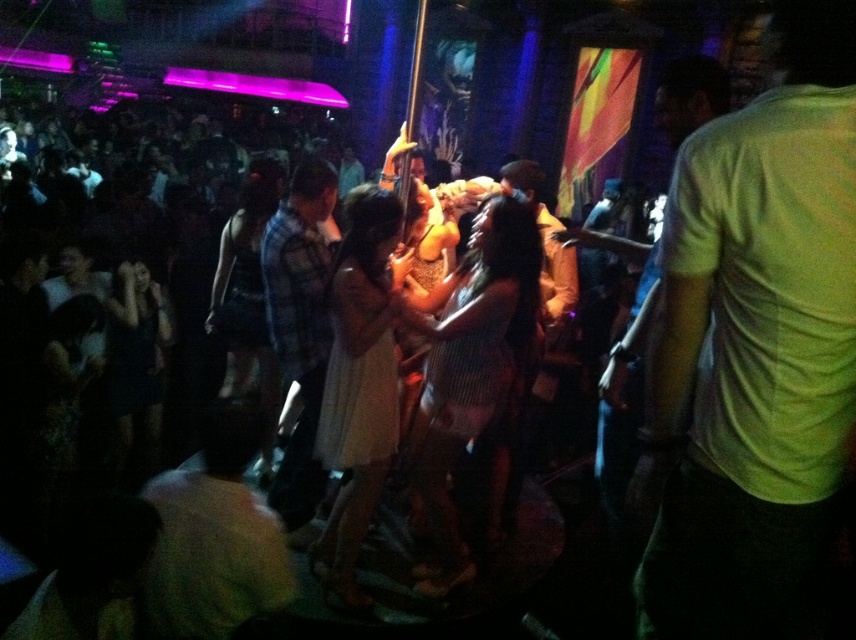
Question: Where is white matte shirt at lower left located in relation to plaid fabric shirt at center in the image?

Choices:
 (A) below
 (B) above

Answer: (A)

Question: Is light green t-shirt at right above plaid fabric shirt at center?

Choices:
 (A) yes
 (B) no

Answer: (A)

Question: Which object is closer to the camera taking this photo?

Choices:
 (A) white matte shirt at lower left
 (B) light green t-shirt at right
 (C) plaid fabric shirt at center

Answer: (B)

Question: Which point appears closest to the camera in this image?

Choices:
 (A) (676, 557)
 (B) (302, 227)

Answer: (A)

Question: Where is light green t-shirt at right located in relation to white matte shirt at lower left in the image?

Choices:
 (A) below
 (B) above

Answer: (B)

Question: Which point appears farthest from the camera in this image?

Choices:
 (A) (698, 234)
 (B) (266, 298)
 (C) (146, 621)

Answer: (B)